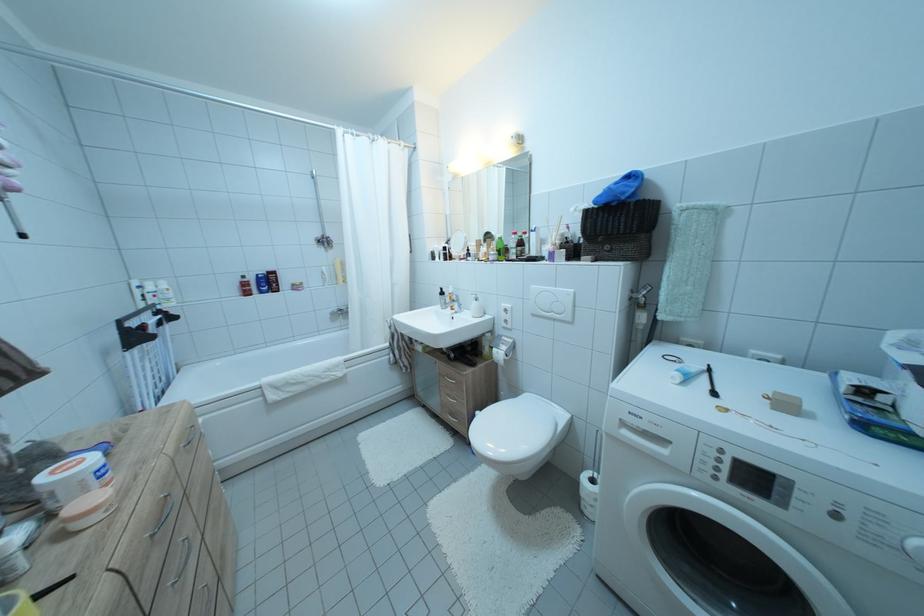
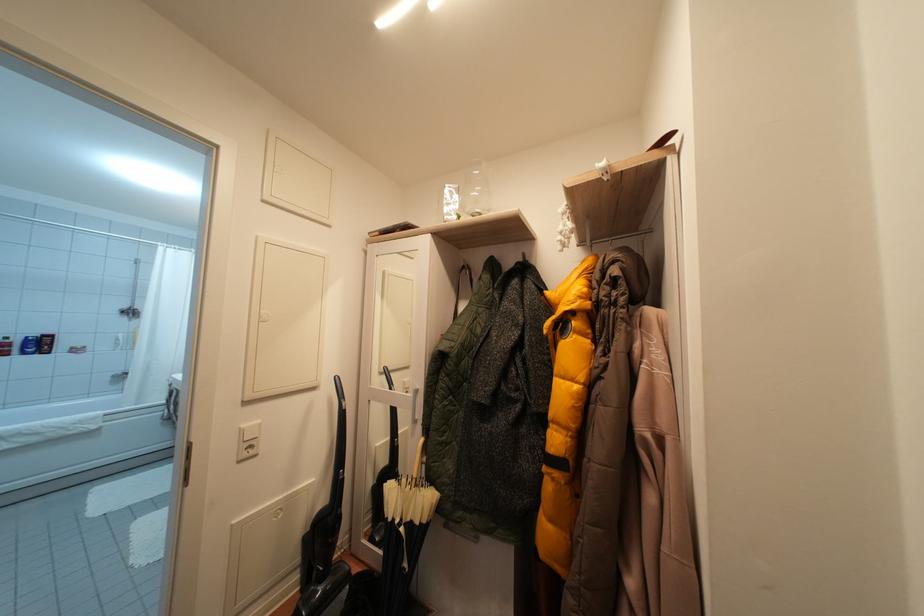
In a continuous first-person perspective shot, in which direction is the camera moving?

The cameraman walked toward right, backward.